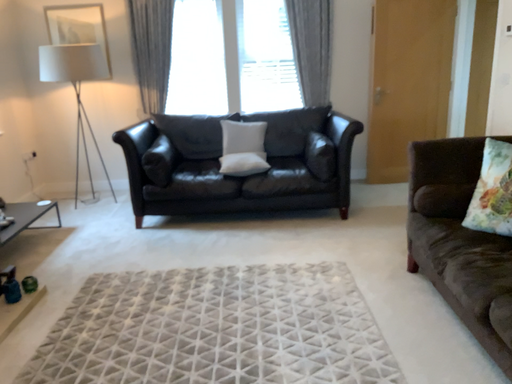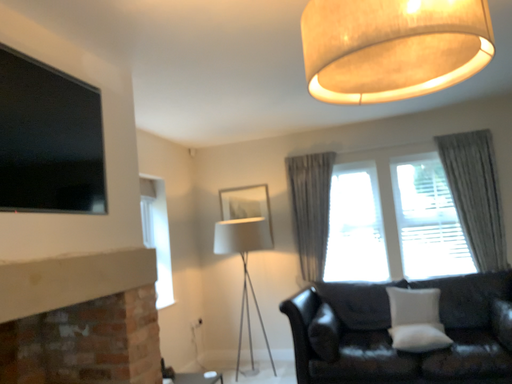
Question: How did the camera likely rotate when shooting the video?

Choices:
 (A) rotated right
 (B) rotated left

Answer: (B)